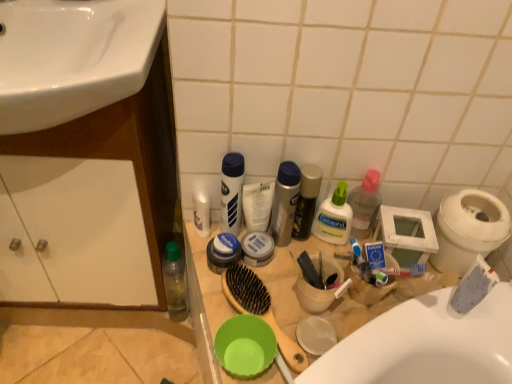
Image resolution: width=512 pixels, height=384 pixels. I want to click on free space in front of shiny black bottle at center, the third toiletry when ordered from right to left, so click(x=293, y=279).